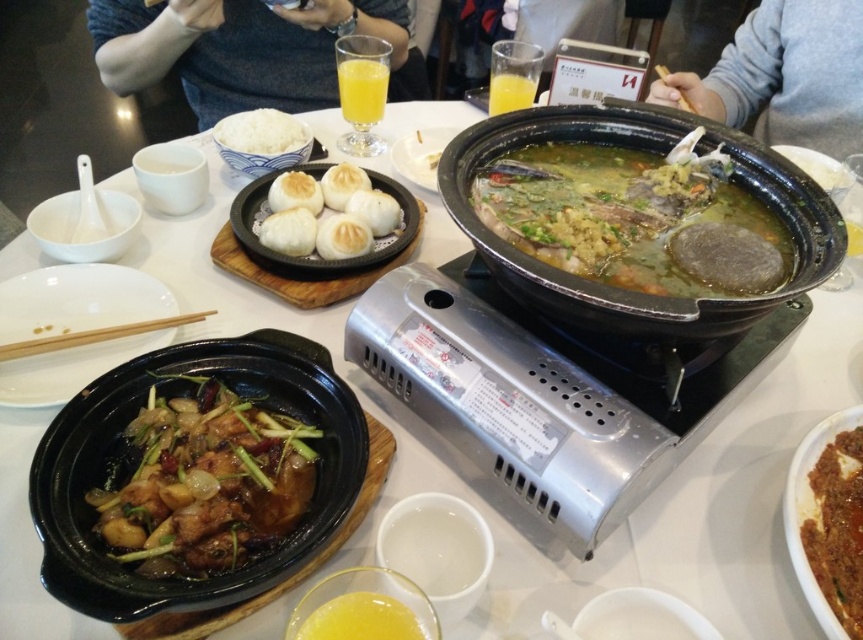
Question: Which object is positioned farthest from the translucent glass of orange juice at center?

Choices:
 (A) white matte rice at upper left
 (B) white matte buns at center

Answer: (B)

Question: Which object is the farthest from the wooden chopsticks at left?

Choices:
 (A) white matte buns at center
 (B) white matte rice at upper left

Answer: (B)

Question: Does gray fabric shirt at upper left have a larger size compared to tomato sauce tofu at center?

Choices:
 (A) yes
 (B) no

Answer: (A)

Question: Which of the following is the farthest from the observer?

Choices:
 (A) (763, 22)
 (B) (146, 531)
 (C) (46, 342)
 (D) (60, 284)

Answer: (A)

Question: Can you confirm if gray fabric shirt at upper left is wider than wooden chopstick at upper center?

Choices:
 (A) no
 (B) yes

Answer: (B)

Question: Does white glossy plate at lower left appear on the right side of translucent glass at upper center?

Choices:
 (A) yes
 (B) no

Answer: (B)